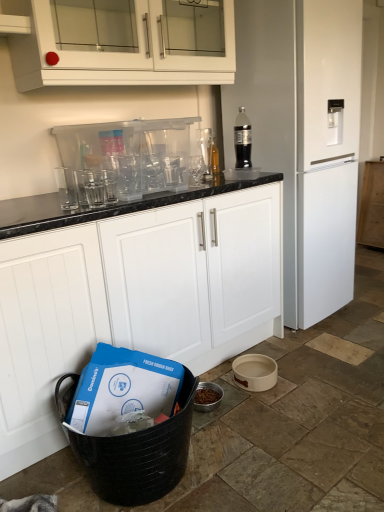
Question: In terms of size, does white matte cabinet at center, which is the 1th cabinetry in front-to-back order, appear bigger or smaller than white matte refrigerator at right?

Choices:
 (A) big
 (B) small

Answer: (A)

Question: Is white matte cabinet at center, acting as the third cabinetry starting from the right, wider or thinner than white matte refrigerator at right?

Choices:
 (A) wide
 (B) thin

Answer: (B)

Question: Which is farther from the white matte refrigerator at right?

Choices:
 (A) clear plastic bottle at upper right, which is the first bottle in front-to-back order
 (B) transparent plastic glasses at upper center, which appears as the 2th appliance when viewed from the right
 (C) white matte cabinet at right, the 1th cabinetry when ordered from right to left
 (D) white ceramic bowl at lower right, which is the 2th appliance in top-to-bottom order
 (E) white glossy cabinet at upper center, the 2th cabinetry from the right

Answer: (D)

Question: Which of these objects is positioned closest to the white glossy cabinet at upper center, which is the 2th cabinetry from front to back?

Choices:
 (A) clear plastic bottle at upper right, which is the 2th bottle in back-to-front order
 (B) white ceramic bowl at lower right, which is the 2th appliance in top-to-bottom order
 (C) transparent plastic glasses at upper center, acting as the second appliance starting from the bottom
 (D) white matte refrigerator at right
 (E) white matte cabinet at center, acting as the third cabinetry starting from the right

Answer: (C)